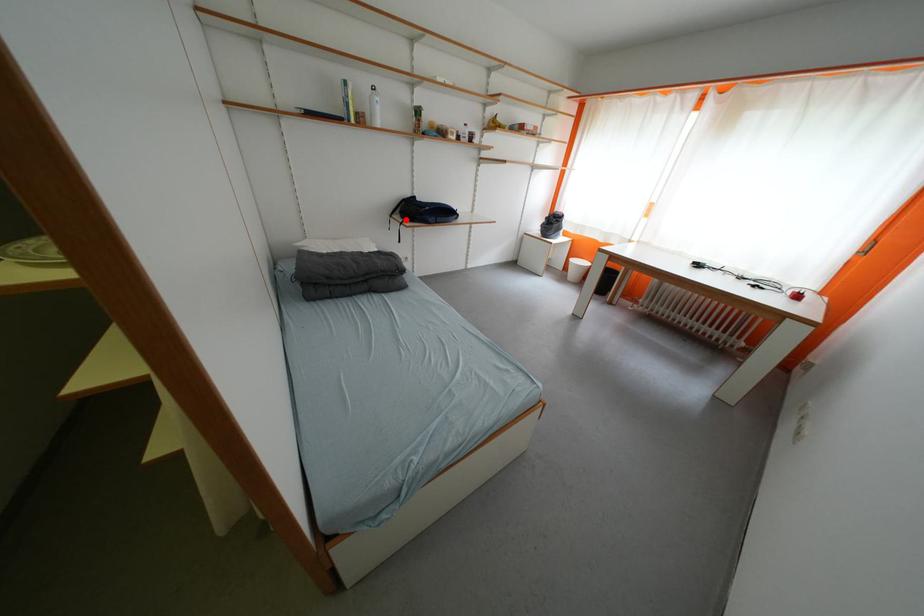
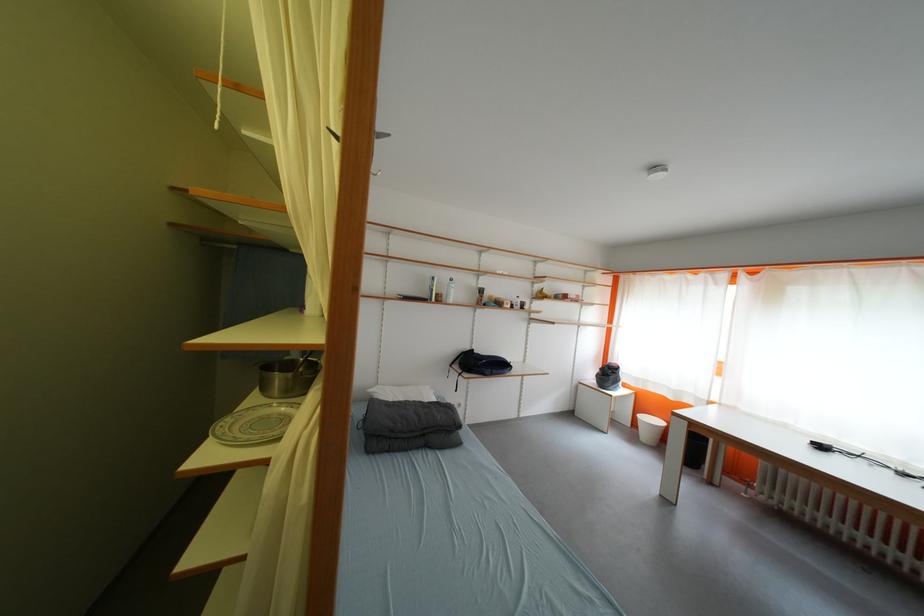
Locate, in the second image, the point that corresponds to the highlighted location in the first image.

(466, 370)